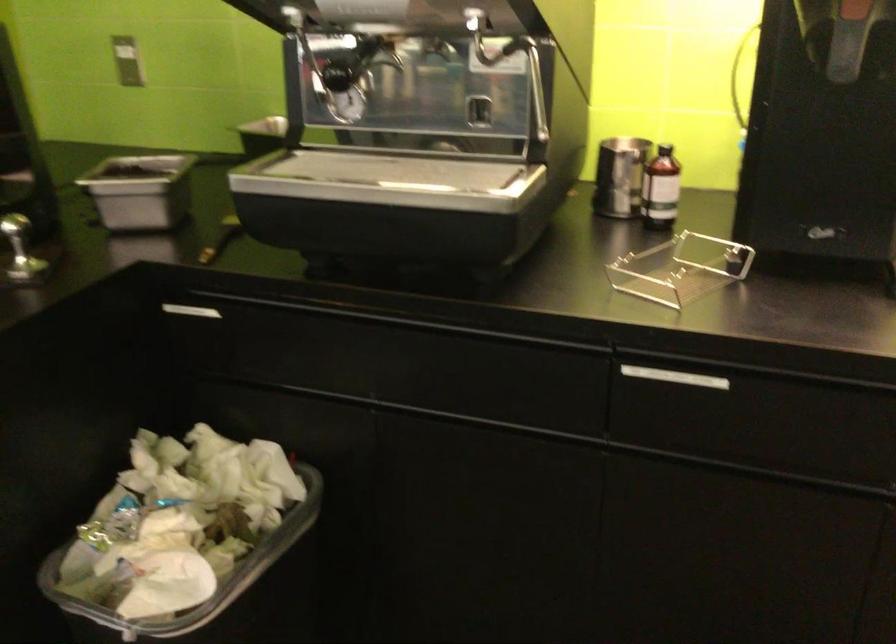
Which object does [218,592] point to?

This point indicates the metal food container.